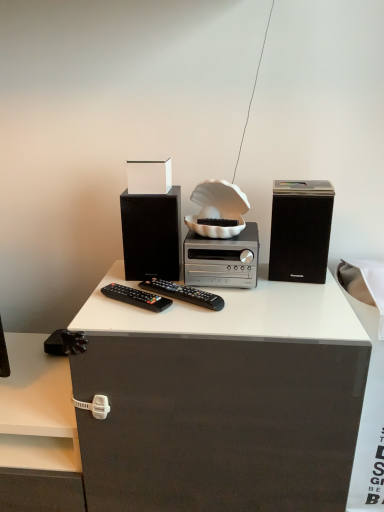
Question: Is black matte speaker at right, which is the 2th speaker in left-to-right order, not close to matte black speaker at center, the first speaker viewed from the left?

Choices:
 (A) no
 (B) yes

Answer: (A)

Question: Is black matte speaker at right, which is the 2th speaker in left-to-right order, facing towards matte black speaker at center, the first speaker viewed from the left?

Choices:
 (A) yes
 (B) no

Answer: (B)

Question: Can you confirm if black matte speaker at right, the 1th speaker from the right, is thinner than matte black speaker at center, the first speaker viewed from the left?

Choices:
 (A) no
 (B) yes

Answer: (A)

Question: From a real-world perspective, is black matte speaker at right, the 1th speaker from the right, beneath matte black speaker at center, the first speaker viewed from the left?

Choices:
 (A) no
 (B) yes

Answer: (A)

Question: Does black matte speaker at right, which is the 2th speaker in left-to-right order, appear on the right side of matte black speaker at center, which is the second speaker in right-to-left order?

Choices:
 (A) yes
 (B) no

Answer: (A)

Question: Is matte black cabinet at right bigger or smaller than matte black speaker at center, which is the second speaker in right-to-left order?

Choices:
 (A) small
 (B) big

Answer: (B)

Question: Considering the positions of matte black cabinet at right and matte black speaker at center, which is the second speaker in right-to-left order, in the image, is matte black cabinet at right wider or thinner than matte black speaker at center, which is the second speaker in right-to-left order,?

Choices:
 (A) thin
 (B) wide

Answer: (B)

Question: Is point (367, 497) closer or farther from the camera than point (153, 261)?

Choices:
 (A) closer
 (B) farther

Answer: (B)

Question: From the image's perspective, relative to matte black speaker at center, the first speaker viewed from the left, is matte black cabinet at right above or below?

Choices:
 (A) above
 (B) below

Answer: (B)

Question: In the image, is silver metallic stereo at center positioned in front of or behind matte black speaker at center, which is the second speaker in right-to-left order?

Choices:
 (A) front
 (B) behind

Answer: (A)

Question: Visually, is silver metallic stereo at center positioned to the left or to the right of matte black speaker at center, the first speaker viewed from the left?

Choices:
 (A) left
 (B) right

Answer: (B)

Question: From the image's perspective, is silver metallic stereo at center located above or below matte black speaker at center, the first speaker viewed from the left?

Choices:
 (A) above
 (B) below

Answer: (B)

Question: From a real-world perspective, is silver metallic stereo at center positioned above or below matte black speaker at center, the first speaker viewed from the left?

Choices:
 (A) below
 (B) above

Answer: (A)

Question: From the image's perspective, relative to matte black cabinet at right, is black matte speaker at right, the 1th speaker from the right, above or below?

Choices:
 (A) below
 (B) above

Answer: (B)

Question: From a real-world perspective, is black matte speaker at right, which is the 2th speaker in left-to-right order, above or below matte black cabinet at right?

Choices:
 (A) above
 (B) below

Answer: (A)